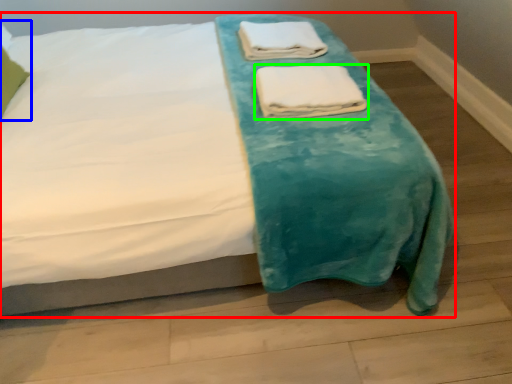
Question: Which object is positioned closest to bed (highlighted by a red box)? Select from pillow (highlighted by a blue box) and towel (highlighted by a green box).

Choices:
 (A) pillow
 (B) towel

Answer: (B)